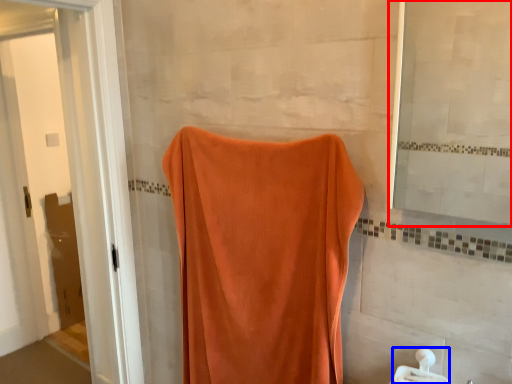
Question: Which object appears closest to the camera in this image, mirror (highlighted by a red box) or towel bar (highlighted by a blue box)?

Choices:
 (A) mirror
 (B) towel bar

Answer: (A)